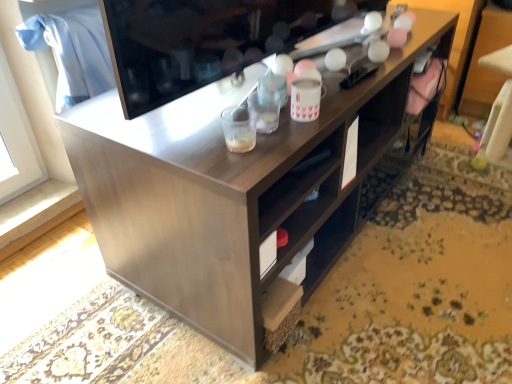
Where is `free space to the back side of white ceramic mug at upper center, which appears as the second beverage when viewed from the left`? The width and height of the screenshot is (512, 384). free space to the back side of white ceramic mug at upper center, which appears as the second beverage when viewed from the left is located at coordinates (323, 87).